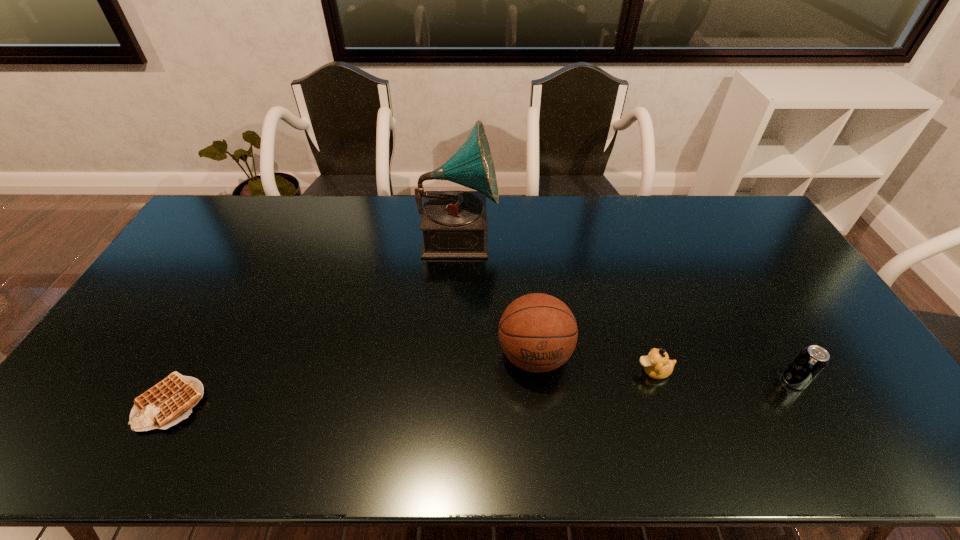
Find the location of `free region located 0.110m on the side with brand label of the second tallest object`. free region located 0.110m on the side with brand label of the second tallest object is located at coordinates (542, 429).

Where is `blank area located on the left of the rightmost object`? Image resolution: width=960 pixels, height=540 pixels. blank area located on the left of the rightmost object is located at coordinates (671, 381).

Identify the location of vacant space located on the face of the duckling. Image resolution: width=960 pixels, height=540 pixels. (606, 371).

You are a GUI agent. You are given a task and a screenshot of the screen. Output one action in this format:
    pyautogui.click(x=<x>, y=<y>)
    Task: Click on the vacant region located on the face of the duckling
    
    Given the screenshot: What is the action you would take?
    pyautogui.click(x=583, y=371)

At what (x,y) coordinates should I click in order to perform the action: click on free space located on the face of the duckling. Please return your answer as a coordinate pair (x, y). Looking at the image, I should click on (579, 371).

You are a GUI agent. You are given a task and a screenshot of the screen. Output one action in this format:
    pyautogui.click(x=<x>, y=<y>)
    Task: Click on the free space located on the back of the leftmost object
    The height and width of the screenshot is (540, 960).
    Given the screenshot: What is the action you would take?
    pyautogui.click(x=217, y=318)

Locate an element on the screen. object located in the far edge section of the desktop is located at coordinates (455, 224).

What are the coordinates of `object that is at the near edge` in the screenshot? It's located at (170, 401).

Where is `vacant space at the far edge of the desktop`? This screenshot has width=960, height=540. vacant space at the far edge of the desktop is located at coordinates (596, 225).

Find the location of a particular element. This screenshot has width=960, height=540. vacant space at the near edge is located at coordinates (493, 436).